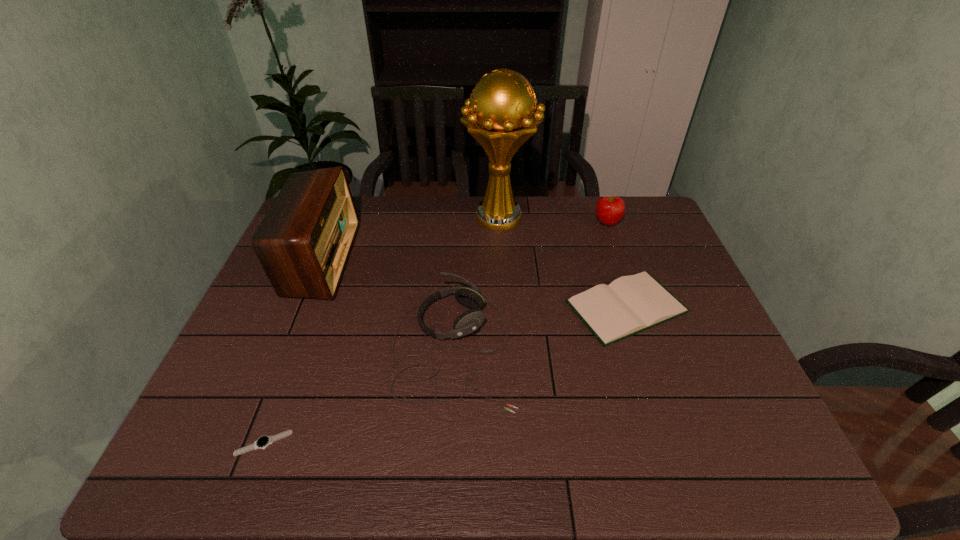
Identify the location of the tallest object. Image resolution: width=960 pixels, height=540 pixels. (499, 115).

The width and height of the screenshot is (960, 540). I want to click on the second tallest object, so click(303, 243).

Where is `apple`? apple is located at coordinates (609, 210).

Identify the location of headset. [x=468, y=322].

At what (x,y) coordinates should I click in order to perform the action: click on the fifth tallest object. Please return your answer as a coordinate pair (x, y). Looking at the image, I should click on (631, 304).

I want to click on the shortest object, so click(263, 442).

The image size is (960, 540). In order to click on the nearest object in this screenshot , I will do `click(263, 442)`.

Find the location of a particular element. The width and height of the screenshot is (960, 540). free space located 0.220m at the front of the tallest object where the globe is prominent is located at coordinates (503, 288).

This screenshot has height=540, width=960. What are the coordinates of `vacant region located 0.260m on the front-facing side of the radio receiver` in the screenshot? It's located at (434, 259).

Find the location of a particular element. Image resolution: width=960 pixels, height=540 pixels. blank area located on the left of the apple is located at coordinates (569, 222).